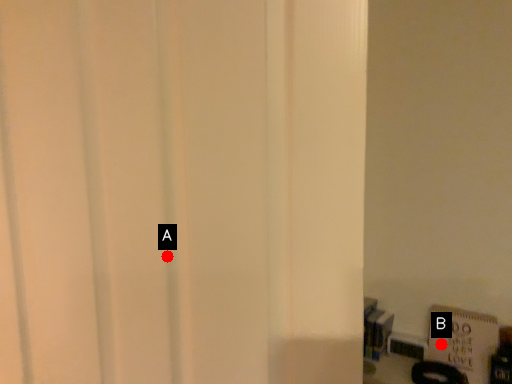
Question: Two points are circled on the image, labeled by A and B beside each circle. Which point is farther from the camera taking this photo?

Choices:
 (A) A is further
 (B) B is further

Answer: (B)